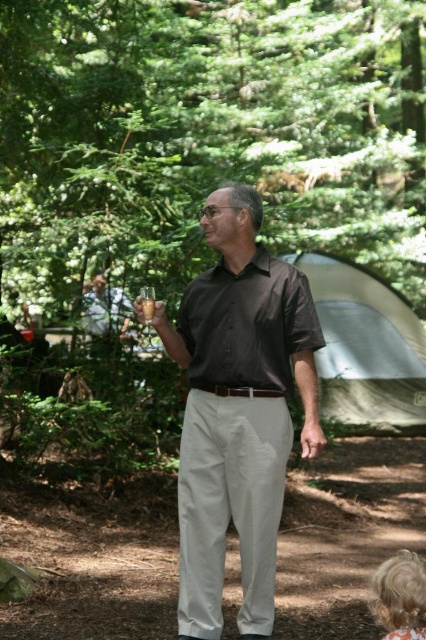
Question: Which point is farther from the camera taking this photo?

Choices:
 (A) (232, 436)
 (B) (275, 291)
 (C) (385, 625)
 (D) (339, 381)

Answer: (D)

Question: Which of these objects is positioned farthest from the blonde hair at lower right?

Choices:
 (A) matte glass at center
 (B) matte black shirt at center

Answer: (A)

Question: Where is brown smooth shirt at center located in relation to gray fabric tent at center in the image?

Choices:
 (A) below
 (B) above

Answer: (A)

Question: Is green leafy tree at upper center wider than matte glass at center?

Choices:
 (A) no
 (B) yes

Answer: (B)

Question: Is brown smooth shirt at center closer to camera compared to matte black shirt at center?

Choices:
 (A) yes
 (B) no

Answer: (A)

Question: Which object appears farthest from the camera in this image?

Choices:
 (A) blonde hair at lower right
 (B) gray fabric tent at center
 (C) brown smooth shirt at center
 (D) green leafy tree at upper center

Answer: (B)